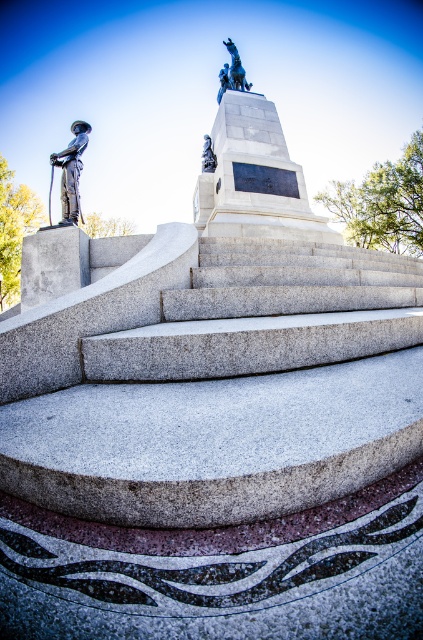
Question: Which of these objects is positioned closest to the polished bronze horse at upper center?

Choices:
 (A) blue polished stone statue at center
 (B) bronze statue at left

Answer: (A)

Question: Among these objects, which one is nearest to the camera?

Choices:
 (A) bronze statue at left
 (B) polished bronze horse at upper center
 (C) blue polished stone statue at center

Answer: (A)

Question: Which is nearer to the bronze statue at left?

Choices:
 (A) blue polished stone statue at center
 (B) polished bronze horse at upper center

Answer: (A)

Question: Where is bronze statue at left located in relation to polished bronze horse at upper center in the image?

Choices:
 (A) above
 (B) below

Answer: (B)

Question: Can you confirm if polished bronze horse at upper center is thinner than blue polished stone statue at center?

Choices:
 (A) no
 (B) yes

Answer: (A)

Question: Is bronze statue at left in front of blue polished stone statue at center?

Choices:
 (A) yes
 (B) no

Answer: (A)